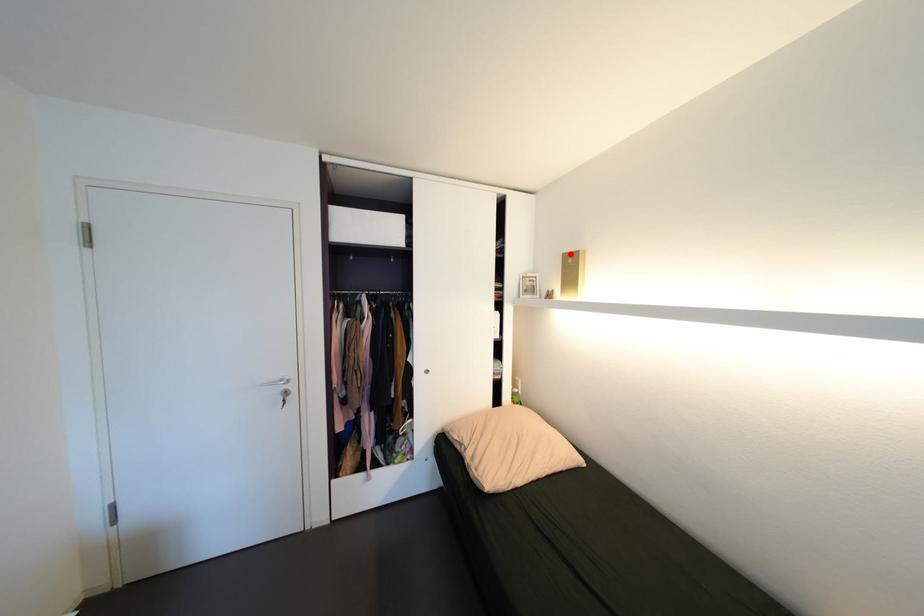
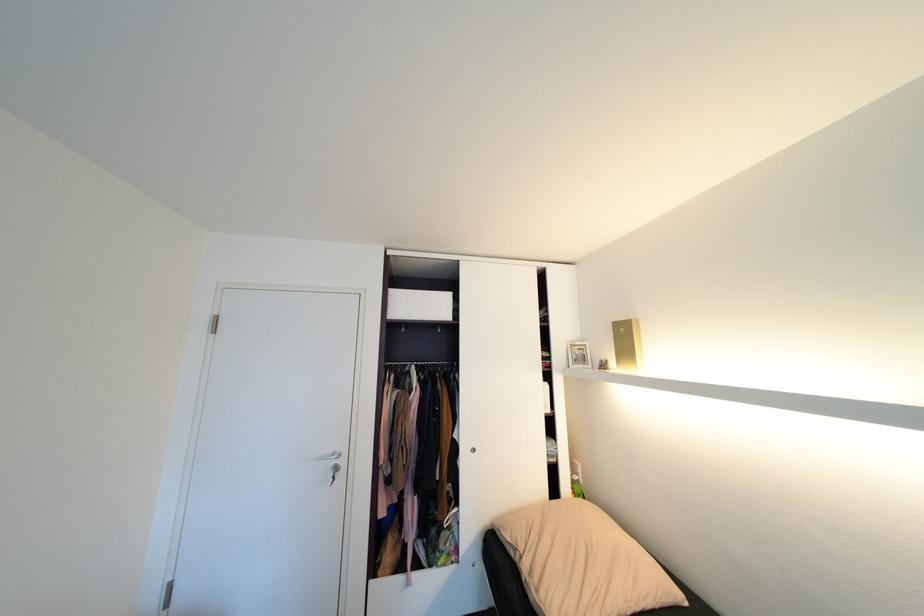
Where in the second image is the point corresponding to the highlighted location from the first image?

(621, 323)